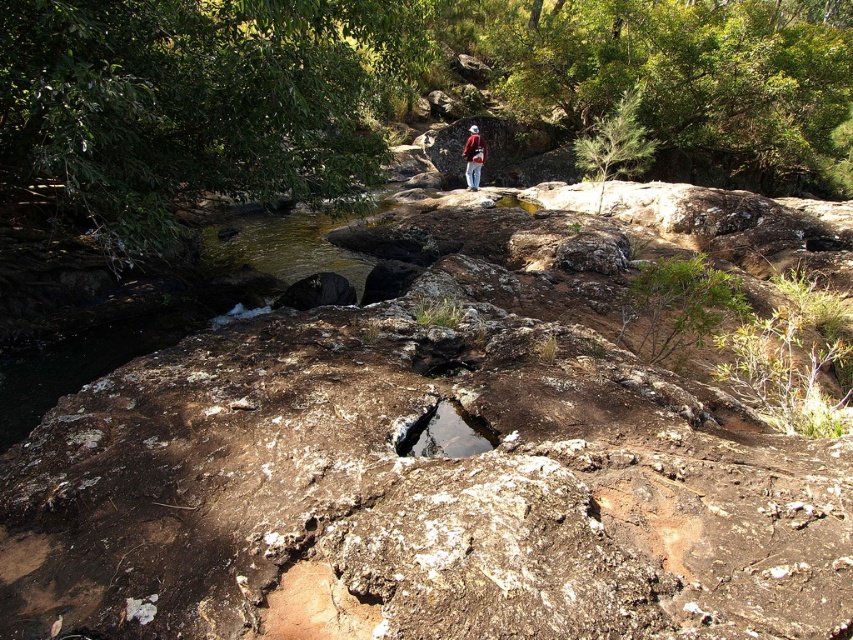
Is brown rough rock at center to the right of red woolen jacket at center from the viewer's perspective?

In fact, brown rough rock at center is to the left of red woolen jacket at center.

Which is more to the left, brown rough rock at center or red woolen jacket at center?

brown rough rock at center

Locate an element on the screen. The width and height of the screenshot is (853, 640). brown rough rock at center is located at coordinates (444, 458).

The height and width of the screenshot is (640, 853). What do you see at coordinates (93, 358) in the screenshot?
I see `brown rock at center` at bounding box center [93, 358].

Is brown rock at center closer to the viewer compared to red woolen jacket at center?

Yes, brown rock at center is closer to the viewer.

Who is more forward, (265, 300) or (469, 141)?

Point (265, 300) is in front.

In order to click on brown rock at center in this screenshot , I will do `click(93, 358)`.

Between brown rough rock at center and brown rock at center, which one has less height?

brown rough rock at center

Which is below, brown rough rock at center or brown rock at center?

Positioned lower is brown rough rock at center.

Is point (665, 465) farther from camera compared to point (216, 253)?

No, it is not.

This screenshot has height=640, width=853. I want to click on brown rough rock at center, so click(444, 458).